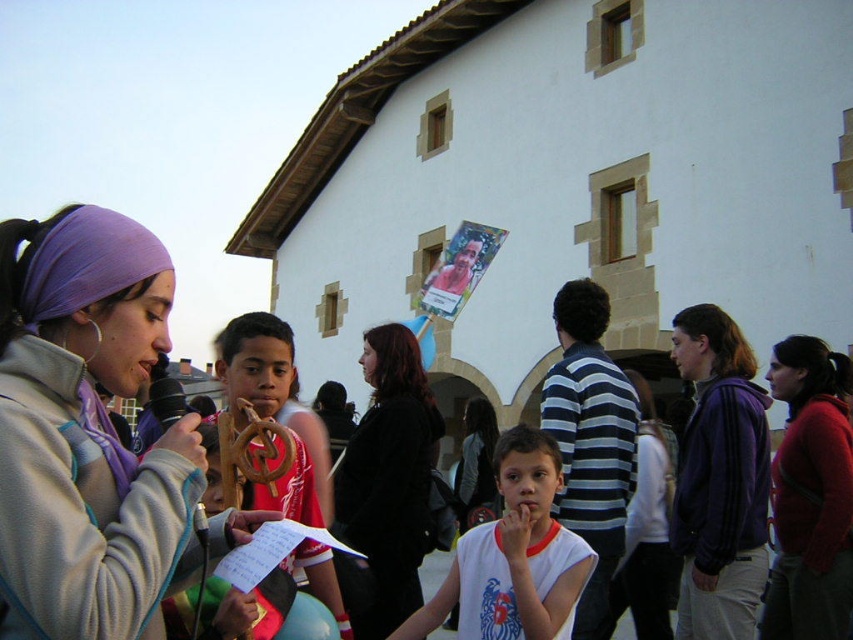
You are a photographer standing in front of the traditional building and want to take a photo of the red sweater at center and the matte paper poster at center. Which object should you focus on first to ensure both are in the frame?

You should focus on the red sweater at center first because it is closer to the viewer than the matte paper poster at center, ensuring both are in the frame.

You are an event planner trying to arrange seating for attendees. You notice the purple fabric headband at upper left and the red sweater at center. Which object is bigger in size?

The purple fabric headband at upper left is larger in size than the red sweater at center.

You are a photographer standing at the position of the woman holding the microphone. You want to take a photo that includes both the purple fabric headscarf at upper left and the matte paper poster at center. Can you fit both in the frame without moving your position?

The distance between the purple fabric headscarf at upper left and the matte paper poster at center is 30.88 meters. Since they are far apart, it might be challenging to fit both in a single frame without moving your position.